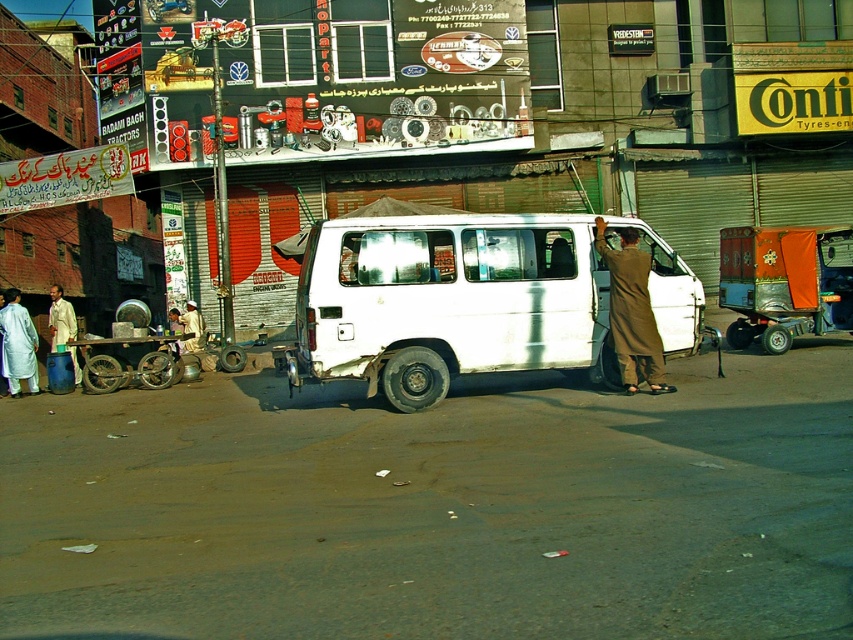
Who is more forward, (650,342) or (148,356)?

Point (650,342) is more forward.

Can you confirm if brown fabric at right is thinner than metallic silver cart at lower left?

Indeed, brown fabric at right has a lesser width compared to metallic silver cart at lower left.

The image size is (853, 640). I want to click on brown fabric at right, so click(x=631, y=310).

Between point (822, 241) and point (113, 356), which one is positioned in front?

Point (822, 241) is more forward.

Between point (747, 256) and point (96, 356), which one is positioned behind?

Point (96, 356)

The height and width of the screenshot is (640, 853). What are the coordinates of `orange fabric cart at right` in the screenshot? It's located at (784, 282).

Who is more forward, (805, 257) or (68, 330)?

Point (805, 257)

How distant is orange fabric cart at right from white cotton shirt at left?

The distance of orange fabric cart at right from white cotton shirt at left is 33.23 feet.

Measure the distance between point (830, 268) and camera.

The distance of point (830, 268) from camera is 58.16 feet.

Where is `orange fabric cart at right`? orange fabric cart at right is located at coordinates (784, 282).